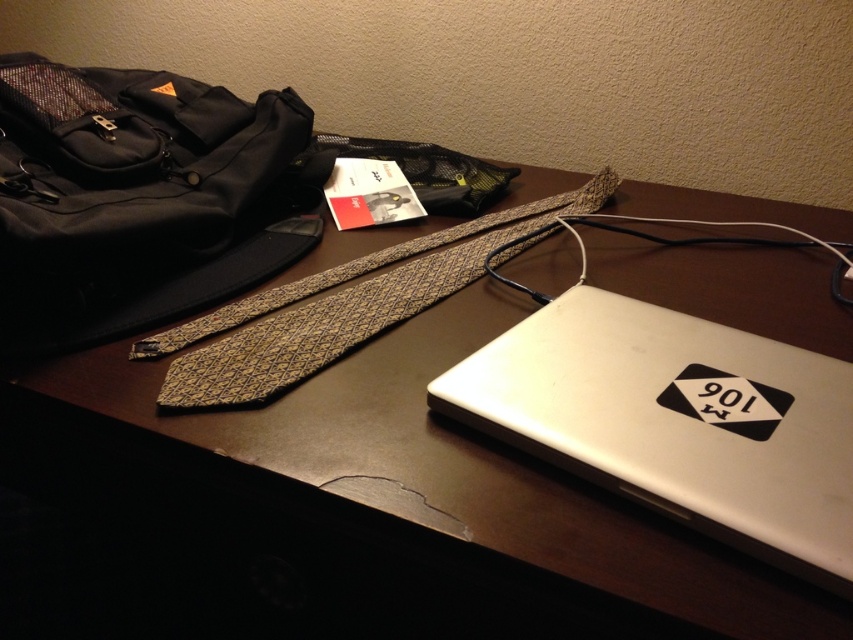
You are a delivery person who needs to place a 13.5 inch box on the desk without moving any existing items. Is there enough space near the satin silver laptop at lower right to fit the box?

The satin silver laptop at lower right is 12.69 inches away from the viewer. Since the box is 13.5 inches long, which is slightly larger than the available space, there isn not enough room to place the box near the satin silver laptop at lower right without moving other items.

You are organizing your desk and need to place a new item between the satin silver laptop at lower right and the gold textured tie at center. Given their positions, where should you place this new item to ensure it is between them?

The new item should be placed to the left of the satin silver laptop at lower right and to the right of the gold textured tie at center, as the laptop is positioned to the right of the tie.